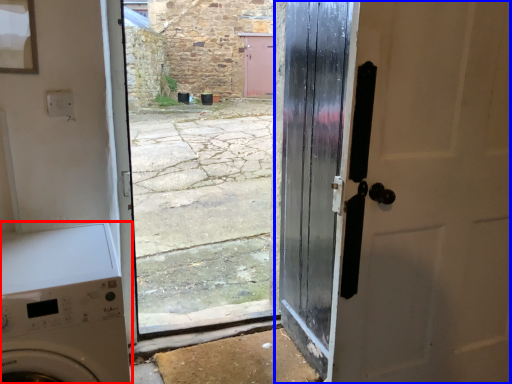
Question: Among these objects, which one is farthest to the camera, washing machine (highlighted by a red box) or door (highlighted by a blue box)?

Choices:
 (A) washing machine
 (B) door

Answer: (B)